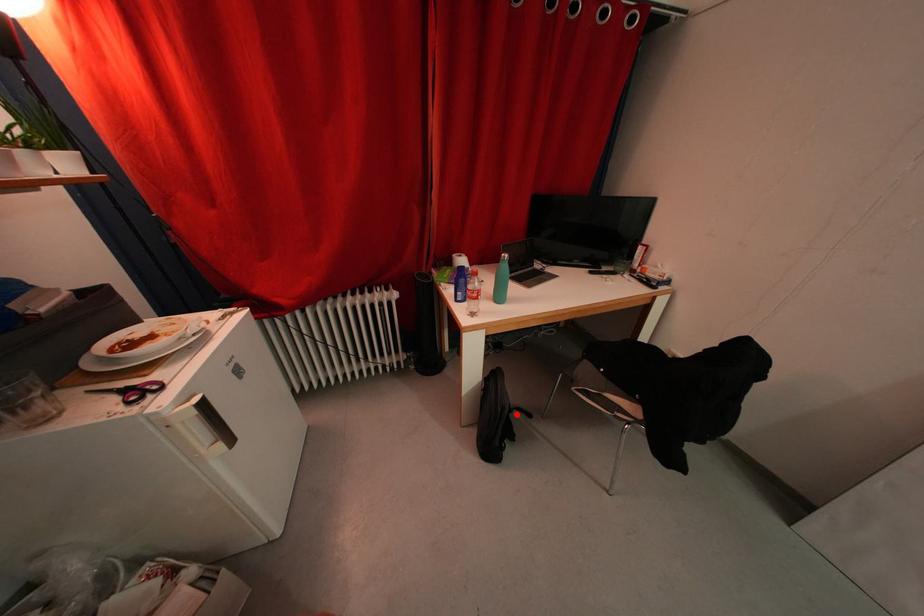
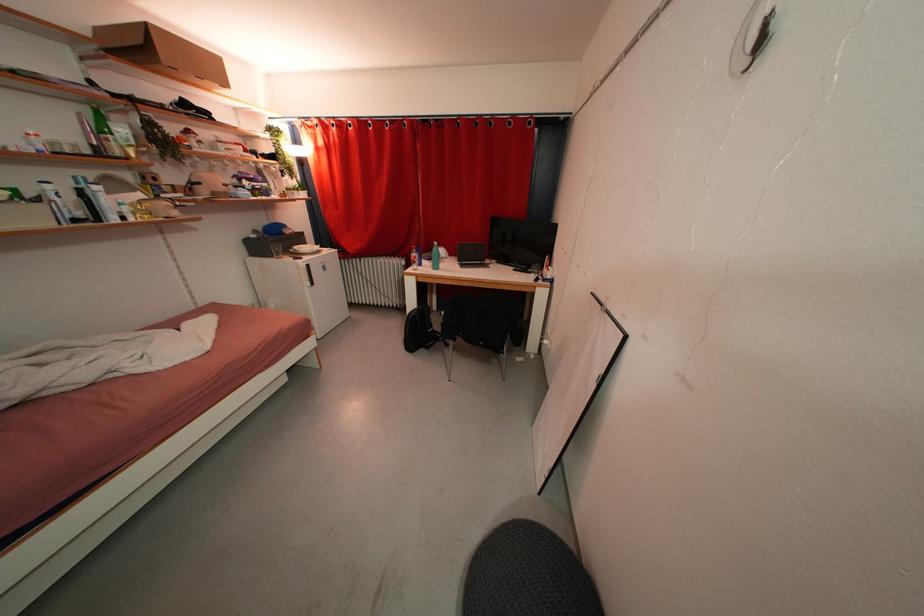
Question: I am providing you with two images of the same scene from different viewpoints. Image1 has a red point marked. In image2, the corresponding 3D location appears at what relative position? Reply with the corresponding letter.

Choices:
 (A) Closer
 (B) Farther

Answer: (B)